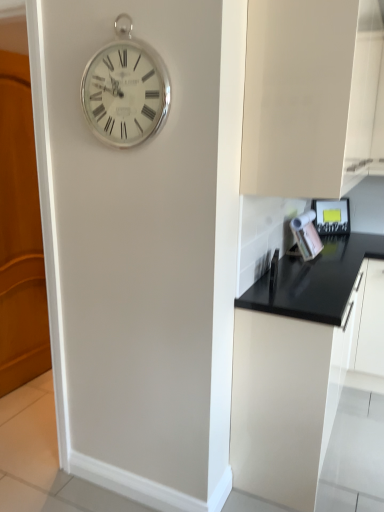
Question: From a real-world perspective, is black matte cabinet at lower right, placed as the first cabinetry when sorted from bottom to top, positioned over metallic silver toaster at right based on gravity?

Choices:
 (A) yes
 (B) no

Answer: (B)

Question: Considering the relative positions of black matte cabinet at lower right, positioned as the 2th cabinetry in top-to-bottom order, and metallic silver toaster at right in the image provided, is black matte cabinet at lower right, positioned as the 2th cabinetry in top-to-bottom order, to the right of metallic silver toaster at right from the viewer's perspective?

Choices:
 (A) no
 (B) yes

Answer: (A)

Question: Is black matte cabinet at lower right, placed as the first cabinetry when sorted from bottom to top, smaller than metallic silver toaster at right?

Choices:
 (A) no
 (B) yes

Answer: (A)

Question: From a real-world perspective, does black matte cabinet at lower right, positioned as the 2th cabinetry in top-to-bottom order, sit lower than metallic silver toaster at right?

Choices:
 (A) yes
 (B) no

Answer: (A)

Question: Can you confirm if black matte cabinet at lower right, positioned as the 2th cabinetry in top-to-bottom order, is taller than metallic silver toaster at right?

Choices:
 (A) yes
 (B) no

Answer: (A)

Question: Is wooden at left to the left or to the right of silver metallic clock at upper center in the image?

Choices:
 (A) right
 (B) left

Answer: (B)

Question: From a real-world perspective, relative to silver metallic clock at upper center, is wooden at left vertically above or below?

Choices:
 (A) below
 (B) above

Answer: (A)

Question: Would you say wooden at left is inside or outside silver metallic clock at upper center?

Choices:
 (A) outside
 (B) inside

Answer: (A)

Question: In terms of size, does wooden at left appear bigger or smaller than silver metallic clock at upper center?

Choices:
 (A) big
 (B) small

Answer: (A)

Question: Considering their positions, is metallic silver toaster at right located in front of or behind silver metallic clock at upper center?

Choices:
 (A) front
 (B) behind

Answer: (B)

Question: Considering the positions of point (337, 207) and point (130, 129), is point (337, 207) closer or farther from the camera than point (130, 129)?

Choices:
 (A) closer
 (B) farther

Answer: (B)

Question: From the image's perspective, relative to silver metallic clock at upper center, is metallic silver toaster at right above or below?

Choices:
 (A) below
 (B) above

Answer: (A)

Question: In terms of size, does metallic silver toaster at right appear bigger or smaller than silver metallic clock at upper center?

Choices:
 (A) small
 (B) big

Answer: (B)

Question: Do you think silver metallic clock at upper center is within wooden at left, or outside of it?

Choices:
 (A) outside
 (B) inside

Answer: (A)

Question: From the image's perspective, is silver metallic clock at upper center positioned above or below wooden at left?

Choices:
 (A) above
 (B) below

Answer: (A)